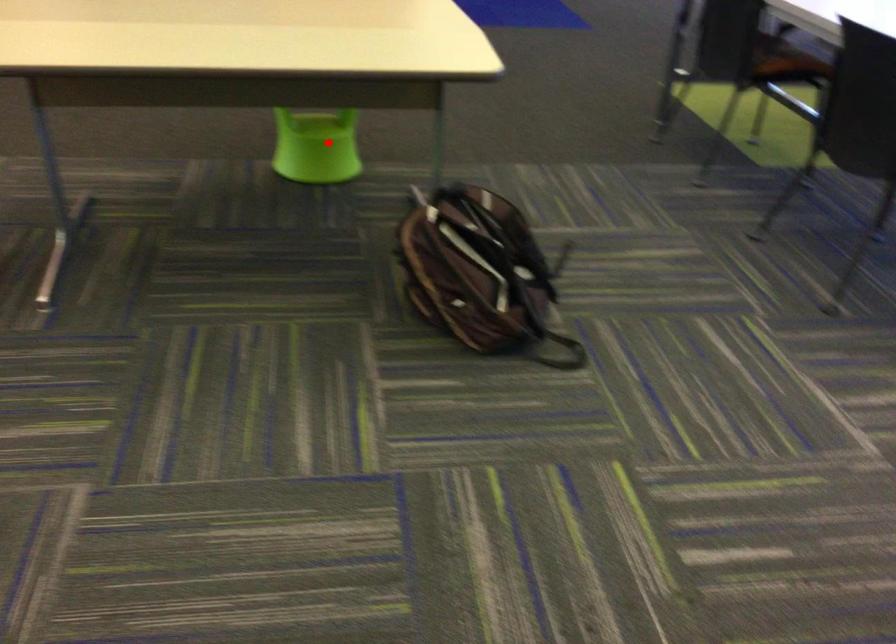
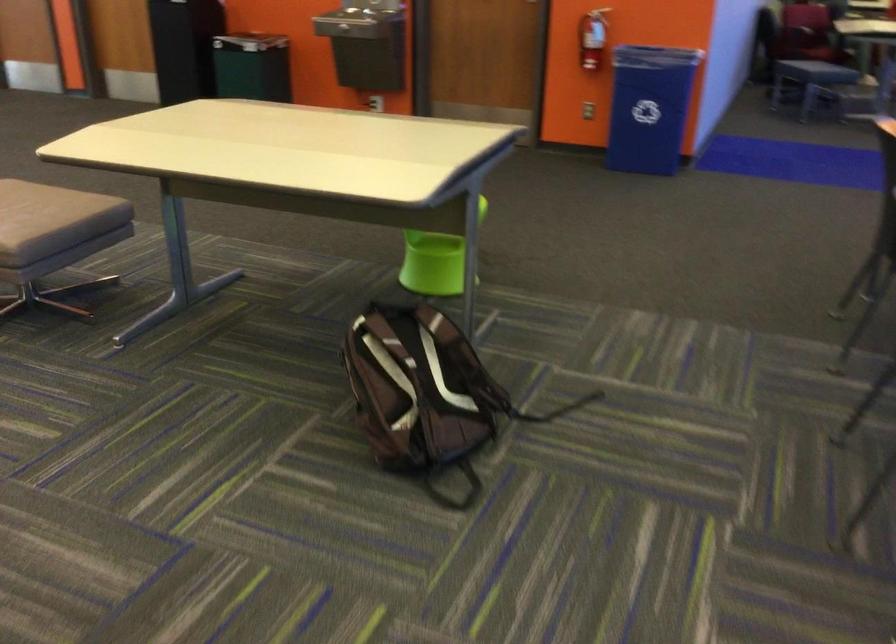
Locate, in the second image, the point that corresponds to the highlighted location in the first image.

(435, 261)